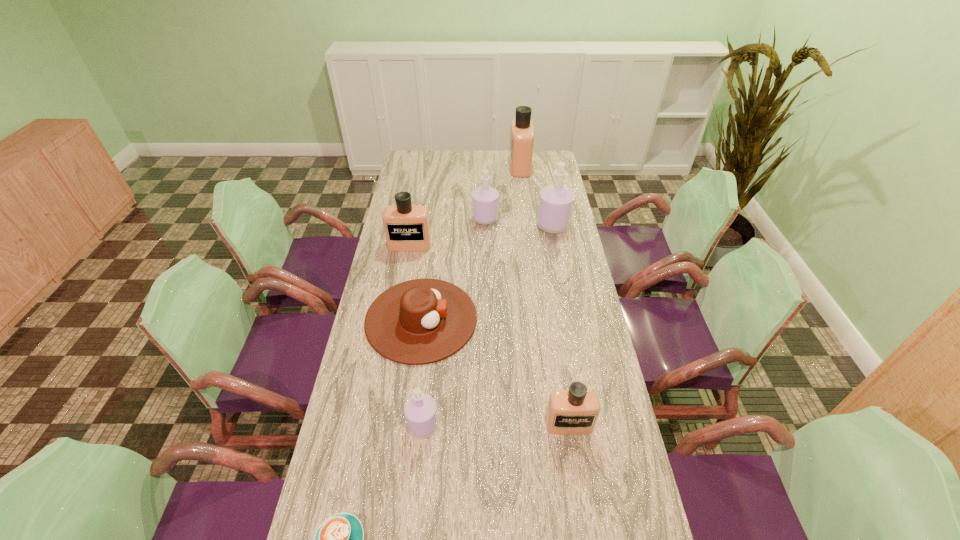
At what (x,y) coordinates should I click in order to perform the action: click on the fourth nearest object. Please return your answer as a coordinate pair (x, y). The width and height of the screenshot is (960, 540). Looking at the image, I should click on (420, 321).

Identify the location of the seventh tallest object. The image size is (960, 540). (420, 321).

What are the coordinates of `free space located 0.070m on the front label of the biggest beige perfume` in the screenshot? It's located at tap(495, 166).

At what (x,y) coordinates should I click in order to perform the action: click on vacant space located on the front label of the biggest beige perfume. Please return your answer as a coordinate pair (x, y). Looking at the image, I should click on (482, 166).

Find the location of a particular element. This screenshot has width=960, height=540. blank space located 0.400m on the front label of the biggest beige perfume is located at coordinates (431, 166).

Where is `vacant space located on the back of the biggest purple perfume`? This screenshot has height=540, width=960. vacant space located on the back of the biggest purple perfume is located at coordinates (546, 191).

Locate an element on the screen. The width and height of the screenshot is (960, 540). vacant space located 0.340m on the front of the second purple perfume from right to left is located at coordinates (486, 282).

Where is `free region located 0.070m on the front label of the second farthest beige perfume`? The width and height of the screenshot is (960, 540). free region located 0.070m on the front label of the second farthest beige perfume is located at coordinates (406, 264).

Identify the location of vacant region located 0.210m on the front of the nearest purple perfume. The width and height of the screenshot is (960, 540). (414, 524).

Find the location of a particular element. vacant point located 0.160m on the front label of the nearest beige perfume is located at coordinates (580, 496).